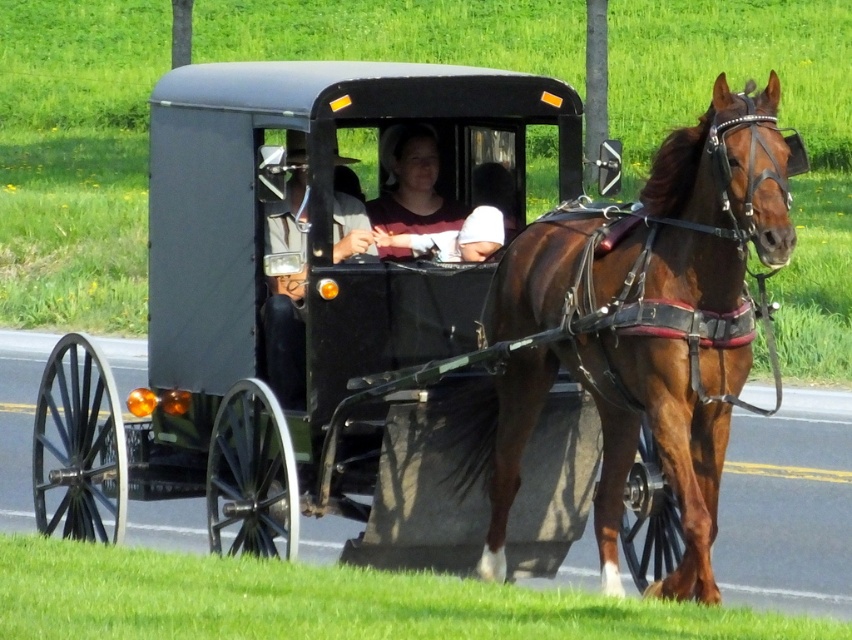
Which is in front, point (38, 428) or point (298, 339)?

Positioned in front is point (298, 339).

Is matte black wagon at center thinner than matte black buggy at center?

In fact, matte black wagon at center might be wider than matte black buggy at center.

Who is more distant from viewer, (251,136) or (297,372)?

Point (297,372)

Where is `matte black wagon at center`? matte black wagon at center is located at coordinates (296, 310).

Does brown glossy horse at center have a greater width compared to matte black buggy at center?

Correct, the width of brown glossy horse at center exceeds that of matte black buggy at center.

Is point (666, 156) in front of point (296, 250)?

Yes, point (666, 156) is closer to viewer.

At what (x,y) coordinates should I click in order to perform the action: click on brown glossy horse at center. Please return your answer as a coordinate pair (x, y). This screenshot has height=640, width=852. Looking at the image, I should click on pyautogui.click(x=634, y=332).

Who is lower down, matte purple shirt at center or matte black buggy at center?

matte purple shirt at center is below.

Does matte purple shirt at center appear on the left side of matte black buggy at center?

In fact, matte purple shirt at center is to the right of matte black buggy at center.

The image size is (852, 640). I want to click on matte purple shirt at center, so click(x=439, y=205).